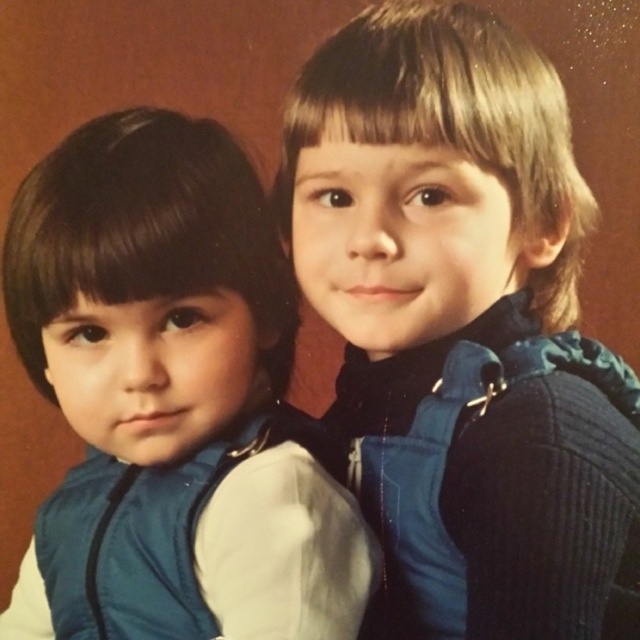
Looking at this image, you are a photographer setting up for a portrait session. You have two vests to choose from for the left and right children. The matte blue vest at left is larger than the blue fleece vest at right. Which vest would you recommend for the child on the right to ensure a proper fit?

The blue fleece vest at right is smaller in size, so it would be more appropriate for the child on the right to ensure a proper fit.

You are a photographer setting up for a group photo. You need to ensure that the blue fabric vest at center and the matte blue vest at left are at least 5 inches apart to avoid overlapping in the photo. Based on the scene described, will their current positioning meet this requirement?

The distance between the blue fabric vest at center and the matte blue vest at left is 6.04 inches, which is more than the required 5 inches, so their current positioning meets the requirement.

You are a photographer trying to adjust the composition of the image. You notice two points marked at coordinates point (67,529) and point (134,550). Which point is positioned further away from the camera?

Point (67,529) is behind point (134,550), so it is further away from the camera.